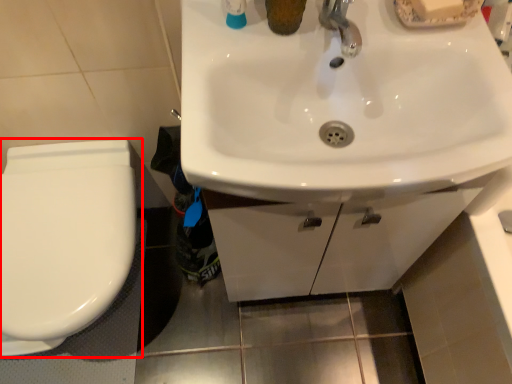
Question: From the image's perspective, considering the relative positions of toilet (annotated by the red box) and sink in the image provided, where is toilet (annotated by the red box) located with respect to the staircase?

Choices:
 (A) above
 (B) below

Answer: (B)